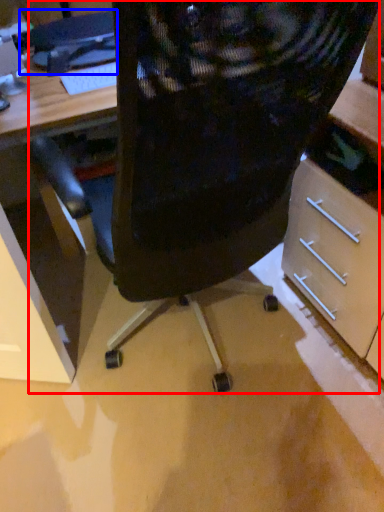
Question: Which object appears closest to the camera in this image, chair (highlighted by a red box) or computer (highlighted by a blue box)?

Choices:
 (A) chair
 (B) computer

Answer: (A)